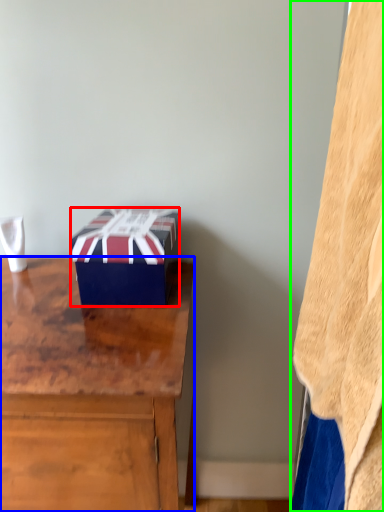
Question: Which object is the closest to the box (highlighted by a red box)? Choose among these: desk (highlighted by a blue box) or blanket (highlighted by a green box).

Choices:
 (A) desk
 (B) blanket

Answer: (A)